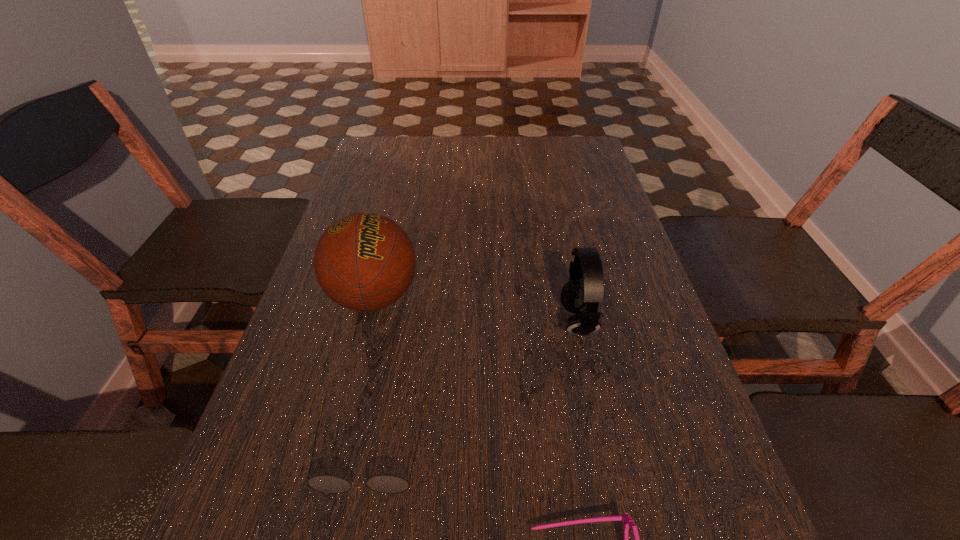
Find the location of a particular element. This screenshot has height=540, width=960. object that is at the right edge is located at coordinates (585, 289).

In the image, there is a desktop. Identify the location of free region at the far edge. (494, 139).

What are the coordinates of `free point at the left edge` in the screenshot? It's located at (346, 421).

Where is `free region at the right edge`? The image size is (960, 540). free region at the right edge is located at coordinates (625, 235).

At what (x,y) coordinates should I click in order to perform the action: click on vacant space at the far right corner. Please return your answer as a coordinate pair (x, y). This screenshot has height=540, width=960. Looking at the image, I should click on (581, 169).

Locate an element on the screen. This screenshot has width=960, height=540. vacant space in between the third shortest object and the farther spectacles is located at coordinates (474, 386).

Find the location of a particular element. The width and height of the screenshot is (960, 540). free space between the third shortest object and the left spectacles is located at coordinates (474, 386).

Identify the location of empty space that is in between the earphone and the basketball. This screenshot has width=960, height=540. point(475,309).

Choose which object is the second nearest neighbor to the basketball. Please provide its 2D coordinates. Your answer should be formatted as a tuple, i.e. [(x, y)], where the tuple contains the x and y coordinates of a point satisfying the conditions above.

[(585, 289)]

Where is `object that ranks as the second closest to the earphone`? This screenshot has width=960, height=540. object that ranks as the second closest to the earphone is located at coordinates (364, 261).